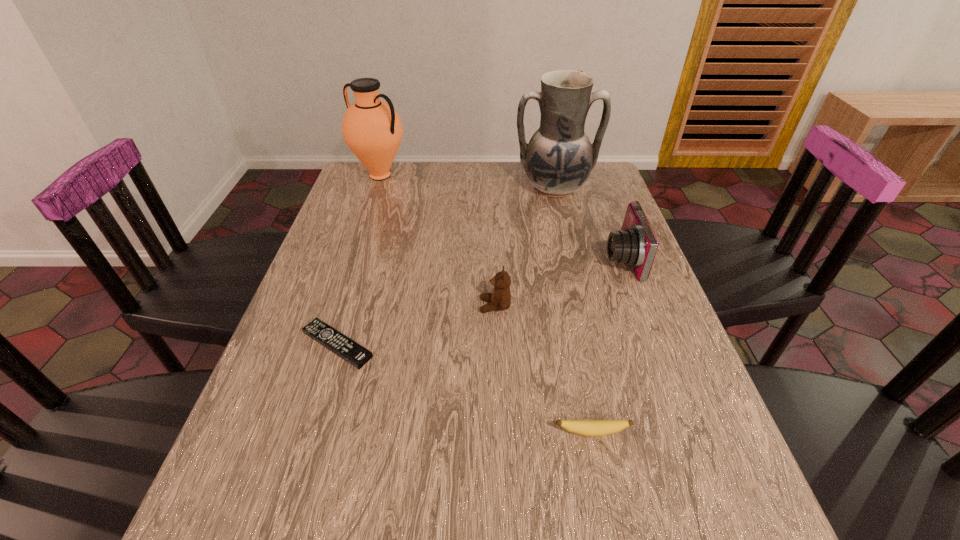
Image resolution: width=960 pixels, height=540 pixels. Find the location of `the right pitcher`. the right pitcher is located at coordinates (558, 160).

At what (x,y) coordinates should I click in order to perform the action: click on the left pitcher. Please return your answer as a coordinate pair (x, y). Looking at the image, I should click on (372, 129).

Image resolution: width=960 pixels, height=540 pixels. I want to click on camera, so click(x=635, y=244).

Where is `the third object from left to right`? This screenshot has height=540, width=960. the third object from left to right is located at coordinates (500, 299).

The height and width of the screenshot is (540, 960). In order to click on the fourth farthest object in this screenshot , I will do [500, 299].

Find the location of a particular element. The height and width of the screenshot is (540, 960). banana is located at coordinates (593, 428).

Identify the location of the nearest object. pyautogui.click(x=593, y=428).

The image size is (960, 540). What are the coordinates of `the second nearest object` in the screenshot? It's located at (344, 347).

What are the coordinates of `remote control` in the screenshot? It's located at (344, 347).

This screenshot has width=960, height=540. Find the location of `vacant space located on the front-facing side of the right pitcher`. vacant space located on the front-facing side of the right pitcher is located at coordinates (571, 261).